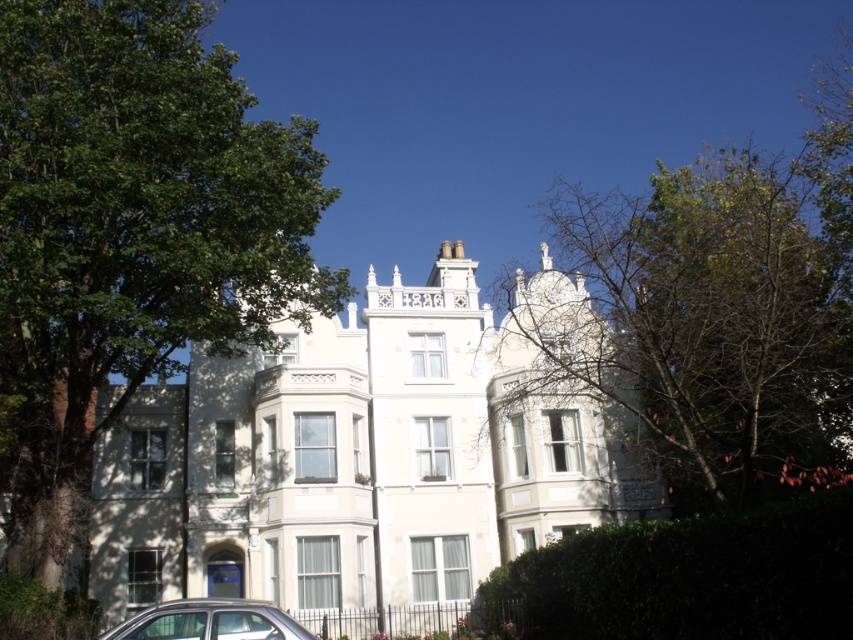
I want to click on green leafy tree at left, so click(x=131, y=234).

Which is above, green leafy tree at left or green leafy hedge at lower right?

Positioned higher is green leafy tree at left.

Between point (106, 326) and point (669, 544), which one is positioned in front?

Point (669, 544) is in front.

This screenshot has height=640, width=853. Find the location of `green leafy tree at left`. green leafy tree at left is located at coordinates (131, 234).

Is green leafy tree at upper right thinner than green leafy hedge at lower right?

In fact, green leafy tree at upper right might be wider than green leafy hedge at lower right.

Which of these two, green leafy tree at upper right or green leafy hedge at lower right, stands shorter?

green leafy hedge at lower right

The height and width of the screenshot is (640, 853). What are the coordinates of `green leafy tree at upper right` in the screenshot? It's located at (717, 310).

In the scene shown: Is green leafy tree at upper right taller than silver metallic car at lower left?

Indeed, green leafy tree at upper right has a greater height compared to silver metallic car at lower left.

Is point (776, 186) positioned behind point (253, 636)?

Yes, it is behind point (253, 636).

Find the location of a particular element. The image size is (853, 640). green leafy tree at upper right is located at coordinates (717, 310).